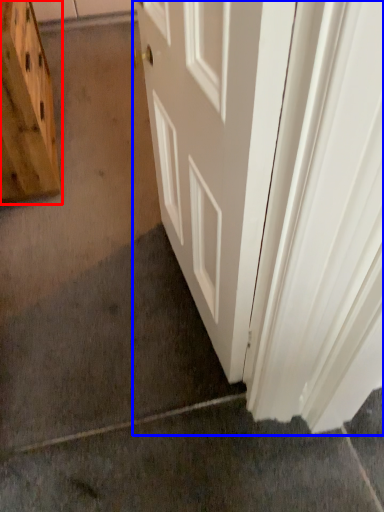
Question: Among these objects, which one is farthest to the camera, cabinetry (highlighted by a red box) or door (highlighted by a blue box)?

Choices:
 (A) cabinetry
 (B) door

Answer: (A)